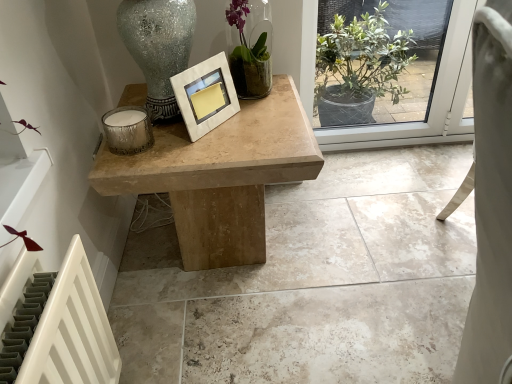
This screenshot has height=384, width=512. I want to click on unoccupied area in front of metallic textured candle at left, so click(x=128, y=162).